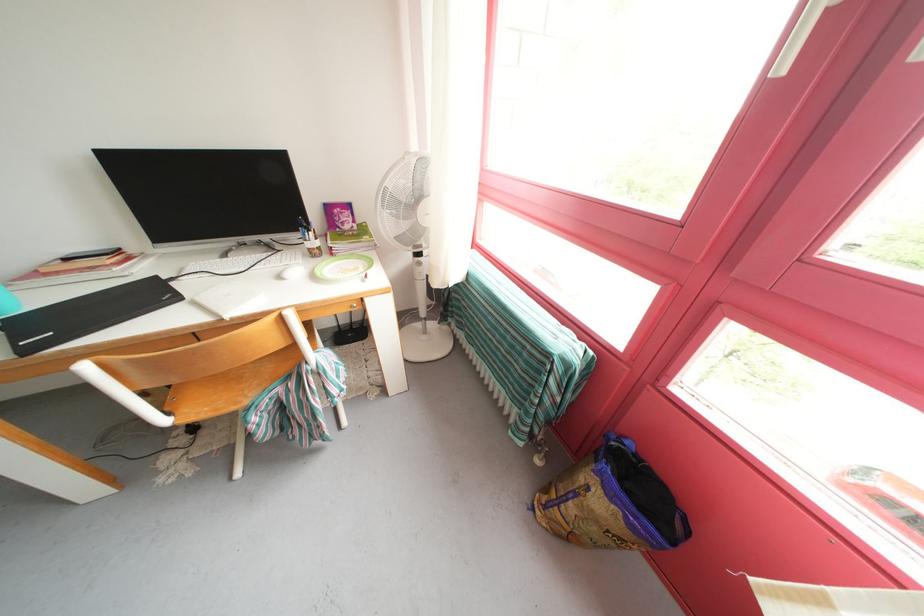
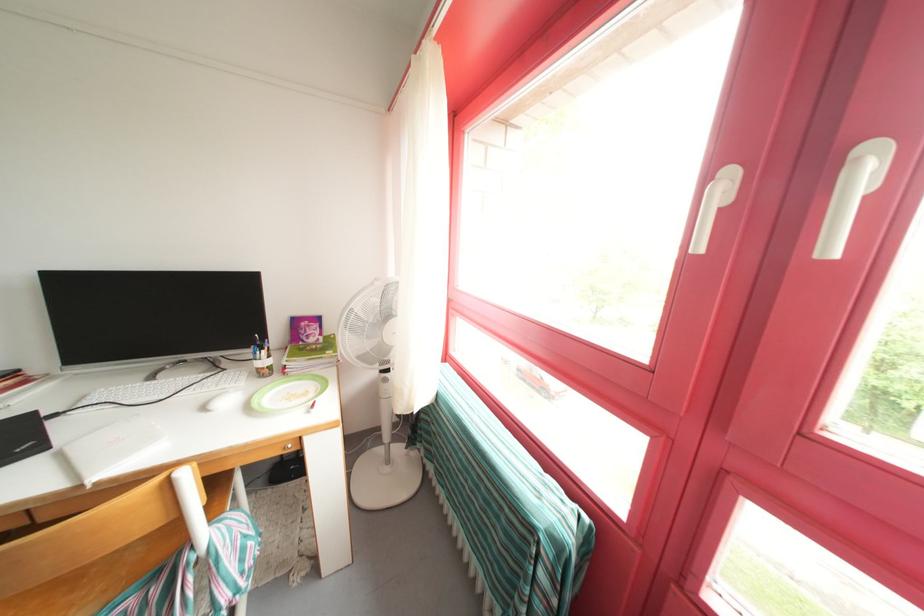
In a continuous first-person perspective shot, in which direction is the camera moving?

The cameraman moved toward right, forward.